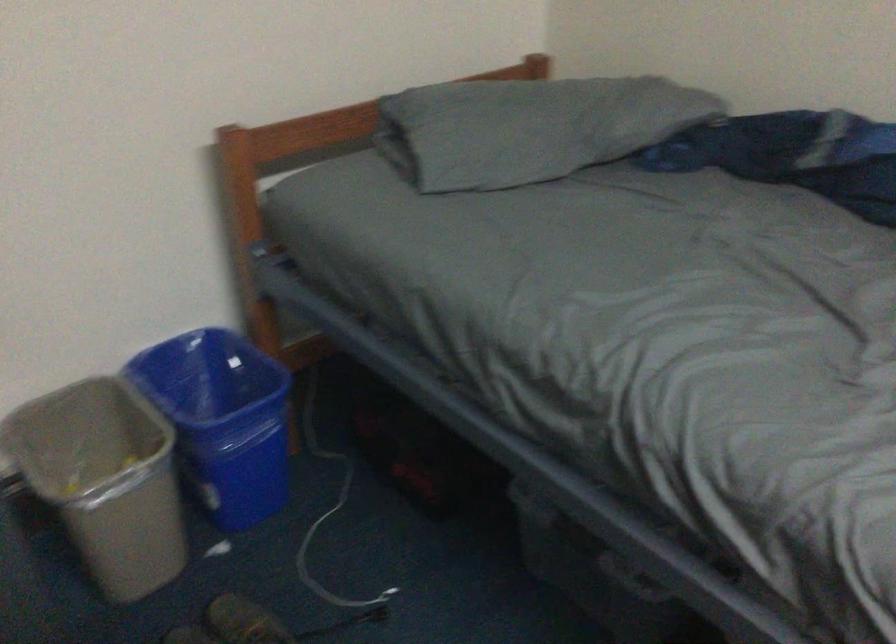
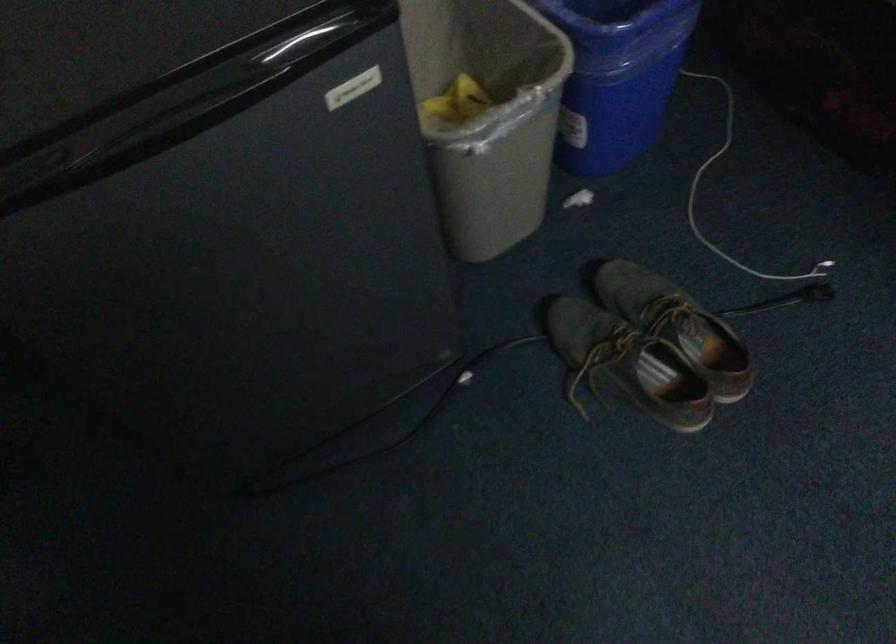
Find the pixel in the second image that matches the point at 225,455 in the first image.

(616, 76)